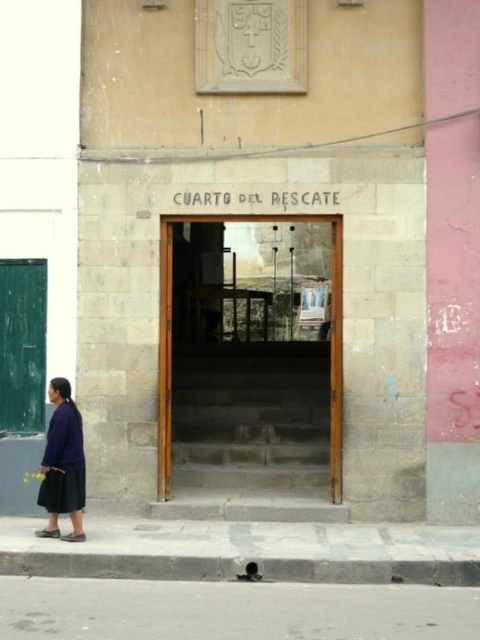
Is stone steps at center behind gray concrete pavement at lower center?

Yes, stone steps at center is further from the viewer.

Is point (176, 252) farther from viewer compared to point (332, 609)?

Yes, it is behind point (332, 609).

Identify the location of stone steps at center. (250, 369).

The image size is (480, 640). Identify the location of stone steps at center. (250, 369).

Who is more distant from viewer, (313,433) or (66,512)?

Positioned behind is point (313,433).

Locate an element on the screen. This screenshot has width=480, height=640. stone steps at center is located at coordinates (250, 369).

Is point (468, 604) in front of point (57, 433)?

Yes.

Is gray concrete pavement at lower center further to the viewer compared to dark blue fabric skirt at lower left?

No, it is in front of dark blue fabric skirt at lower left.

Is point (227, 600) more distant than point (84, 493)?

No, it is not.

You are a GUI agent. You are given a task and a screenshot of the screen. Output one action in this format:
    pyautogui.click(x=<x>, y=<y>)
    Task: Click on the gray concrete pavement at lower center
    
    Given the screenshot: What is the action you would take?
    pyautogui.click(x=231, y=611)